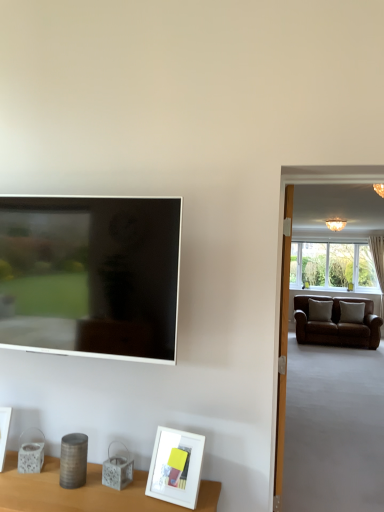
Question: From the image's perspective, relative to white matte picture frame at lower left, the 1th picture frame viewed from the back, is matte black tv at left above or below?

Choices:
 (A) above
 (B) below

Answer: (A)

Question: Is matte black tv at left wider or thinner than white matte picture frame at lower left, the 2th picture frame when ordered from front to back?

Choices:
 (A) thin
 (B) wide

Answer: (A)

Question: Estimate the real-world distances between objects in this image. Which object is closer to the matte black tv at left?

Choices:
 (A) white matte picture frame at lower left, which appears as the 2th picture frame when viewed from the right
 (B) white matte picture frame at lower center, acting as the 2th picture frame starting from the left

Answer: (B)

Question: Estimate the real-world distances between objects in this image. Which object is farther from the white matte picture frame at lower left, the first picture frame in the left-to-right sequence?

Choices:
 (A) matte black tv at left
 (B) white matte picture frame at lower center, acting as the 2th picture frame starting from the left

Answer: (B)